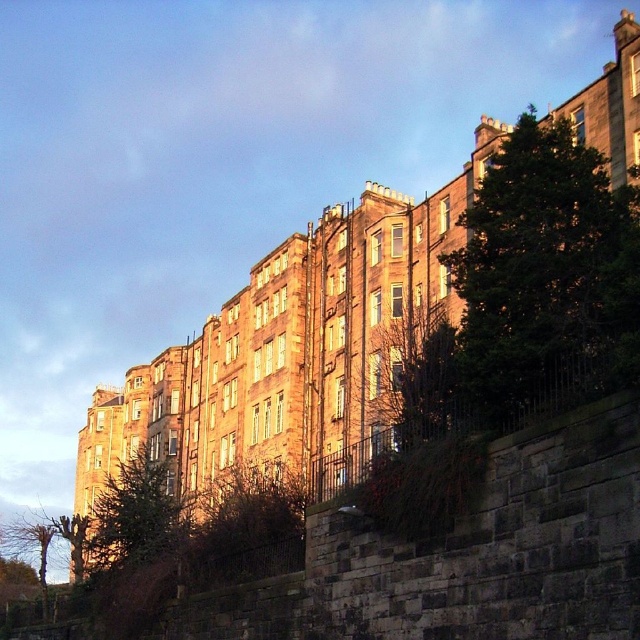
Question: Is dark green leafy tree at right in front of green textured tree at center?

Choices:
 (A) no
 (B) yes

Answer: (B)

Question: Does dark green leafy tree at right have a larger size compared to green textured tree at center?

Choices:
 (A) yes
 (B) no

Answer: (B)

Question: Which object appears farthest from the camera in this image?

Choices:
 (A) dark green leafy tree at right
 (B) green textured tree at center

Answer: (B)

Question: Is dark green leafy tree at right above green textured tree at center?

Choices:
 (A) no
 (B) yes

Answer: (B)

Question: Which of the following is the closest to the observer?

Choices:
 (A) (577, 244)
 (B) (120, 554)

Answer: (A)

Question: Which point is closer to the camera?

Choices:
 (A) green textured tree at center
 (B) dark green leafy tree at right

Answer: (B)